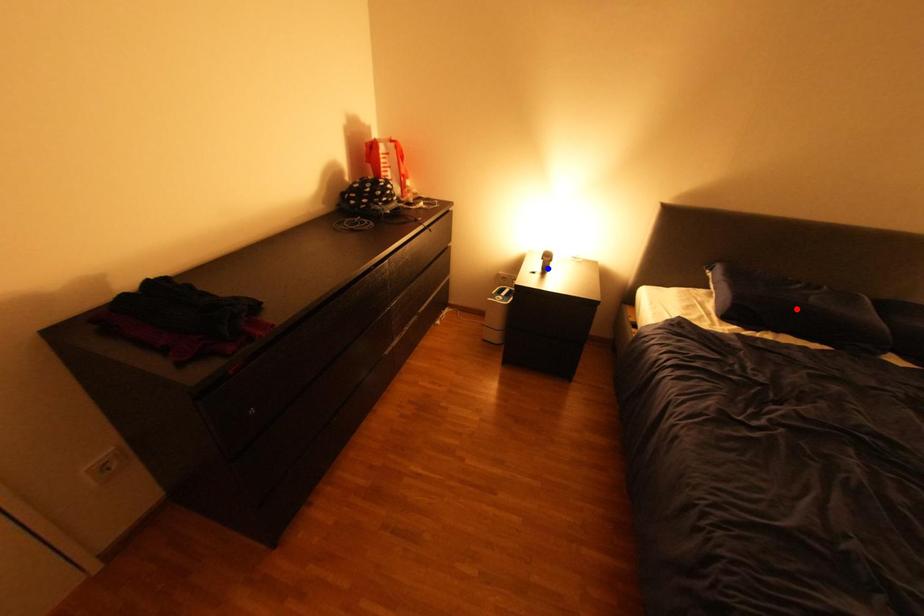
Question: Two points are marked on the image. Which point is closer to the camera?

Choices:
 (A) Blue point is closer.
 (B) Red point is closer.

Answer: (B)